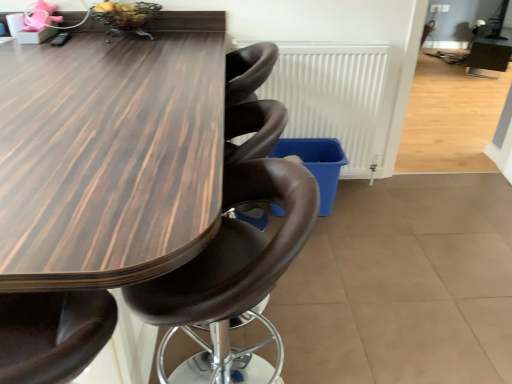
Question: From a real-world perspective, is wooden table at center on white matte radiator at center?

Choices:
 (A) no
 (B) yes

Answer: (A)

Question: Is wooden table at center not within white matte radiator at center?

Choices:
 (A) yes
 (B) no

Answer: (A)

Question: Is wooden table at center thinner than white matte radiator at center?

Choices:
 (A) no
 (B) yes

Answer: (A)

Question: Could you tell me if wooden table at center is turned towards white matte radiator at center?

Choices:
 (A) yes
 (B) no

Answer: (B)

Question: Is wooden table at center next to white matte radiator at center?

Choices:
 (A) yes
 (B) no

Answer: (B)

Question: Is wooden table at center looking in the opposite direction of white matte radiator at center?

Choices:
 (A) yes
 (B) no

Answer: (B)

Question: Can you confirm if wooden table at center is shorter than brown leather chair at center?

Choices:
 (A) no
 (B) yes

Answer: (A)

Question: From a real-world perspective, is wooden table at center on brown leather chair at center?

Choices:
 (A) no
 (B) yes

Answer: (B)

Question: Considering the relative sizes of wooden table at center and brown leather chair at center in the image provided, is wooden table at center bigger than brown leather chair at center?

Choices:
 (A) yes
 (B) no

Answer: (A)

Question: From the image's perspective, is wooden table at center below brown leather chair at center?

Choices:
 (A) no
 (B) yes

Answer: (A)

Question: From a real-world perspective, is wooden table at center positioned under brown leather chair at center based on gravity?

Choices:
 (A) yes
 (B) no

Answer: (B)

Question: Could you tell me if wooden table at center is turned towards brown leather chair at center?

Choices:
 (A) no
 (B) yes

Answer: (A)

Question: Is white matte radiator at center oriented away from wooden table at center?

Choices:
 (A) yes
 (B) no

Answer: (B)